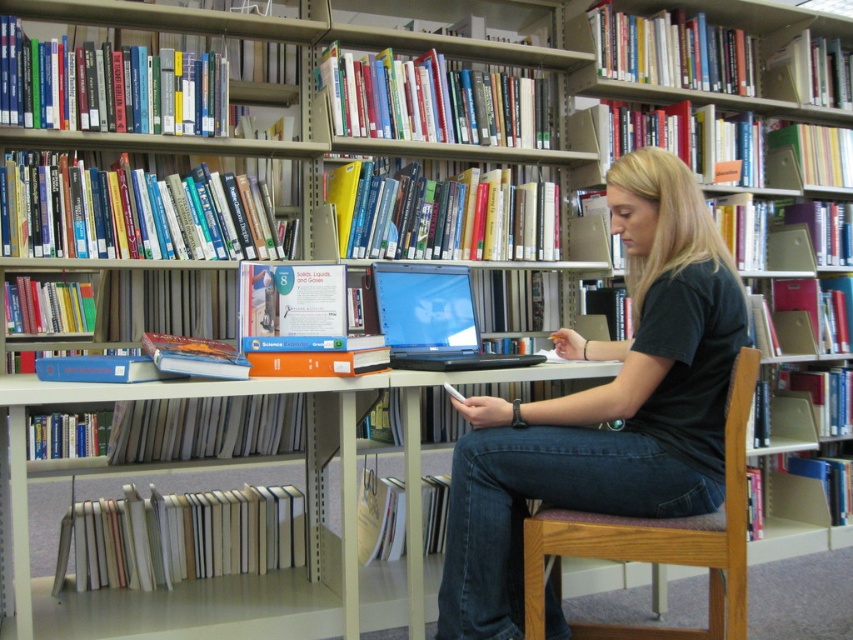
Is white plastic table at center above shiny black laptop at center?

Actually, white plastic table at center is below shiny black laptop at center.

Which of these two, white plastic table at center or shiny black laptop at center, stands taller?

Standing taller between the two is white plastic table at center.

Is point (318, 540) farther from viewer compared to point (526, 360)?

Yes.

The height and width of the screenshot is (640, 853). In order to click on white plastic table at center in this screenshot , I will do `click(268, 577)`.

Who is positioned more to the left, wooden chair at center or shiny black laptop at center?

From the viewer's perspective, shiny black laptop at center appears more on the left side.

Does wooden chair at center appear over shiny black laptop at center?

Actually, wooden chair at center is below shiny black laptop at center.

Between point (532, 532) and point (428, 272), which one is positioned in front?

Point (532, 532) is more forward.

Where is `wooden chair at center`? This screenshot has width=853, height=640. wooden chair at center is located at coordinates (656, 540).

Which is more to the right, white plastic table at center or wooden chair at center?

wooden chair at center

Based on the photo, who is shorter, white plastic table at center or wooden chair at center?

Standing shorter between the two is wooden chair at center.

At what (x,y) coordinates should I click in order to perform the action: click on white plastic table at center. Please return your answer as a coordinate pair (x, y). Looking at the image, I should click on (268, 577).